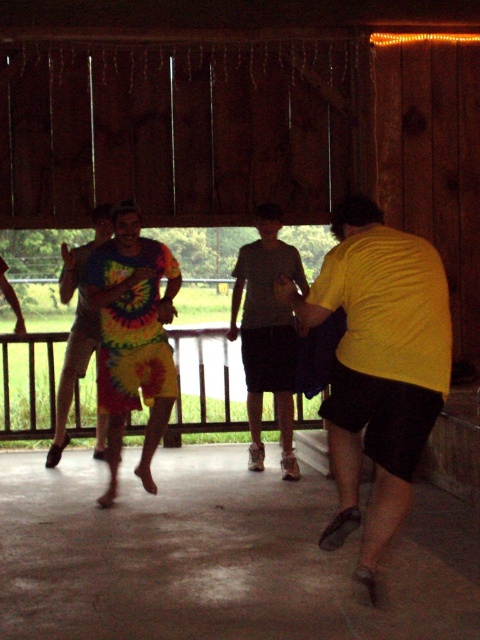
You are a photographer standing at the entrance of the pavilion. You want to take a photo that includes both the yellow matte shirt at right and the gray cotton shirt at center. The camera you are using has a maximum zoom range that can capture objects up to 10 feet apart. Can you capture both subjects in a single frame without moving the camera?

The yellow matte shirt at right and gray cotton shirt at center are 9.09 feet apart, which is within the camera maximum zoom range of 10 feet. Therefore, you can capture both subjects in a single frame without moving the camera.

You are standing in the wooden pavilion and notice two people wearing the yellow matte shirt at right and the gray cotton shirt at center. Which person is shorter?

The yellow matte shirt at right is shorter than the gray cotton shirt at center.